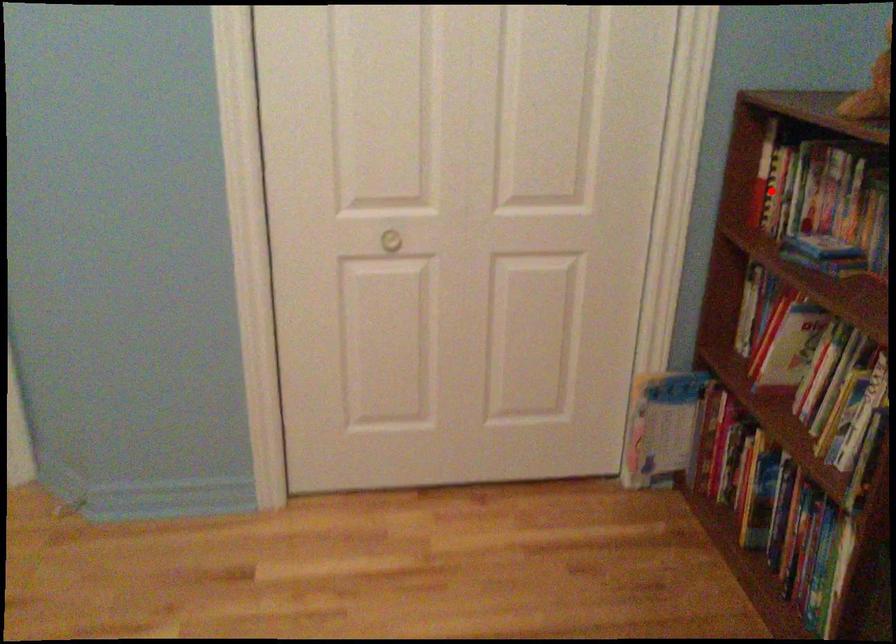
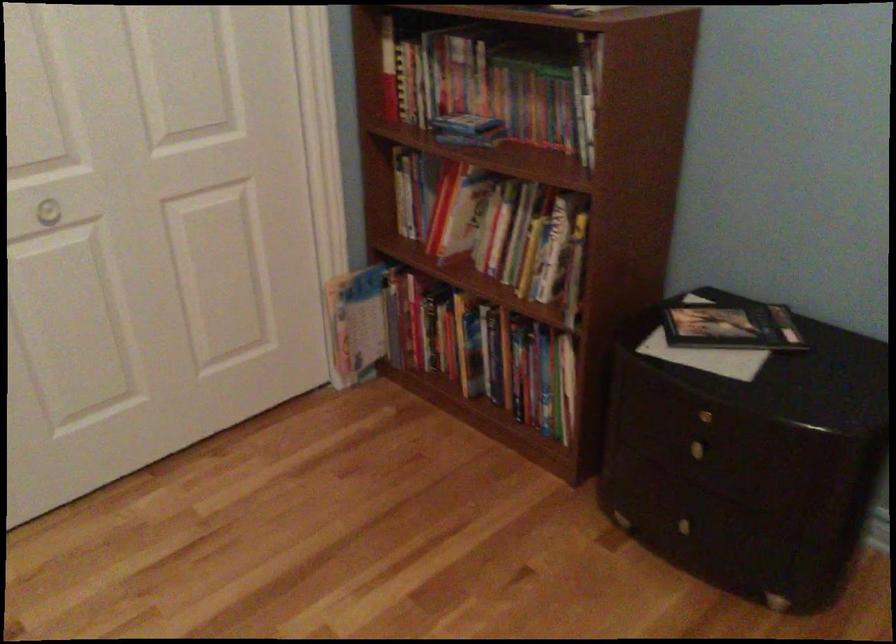
Where in the second image is the point corresponding to the highlighted location from the first image?

(399, 84)